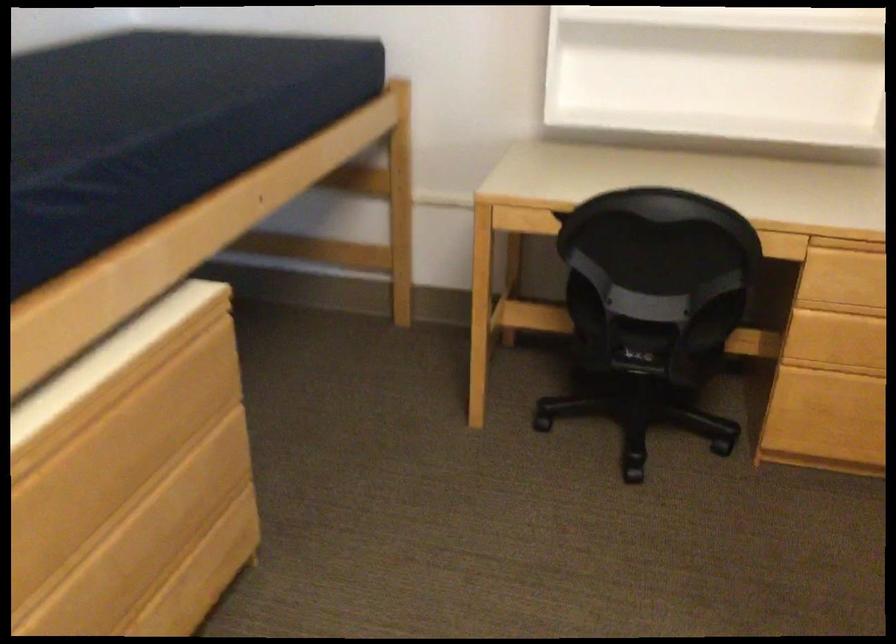
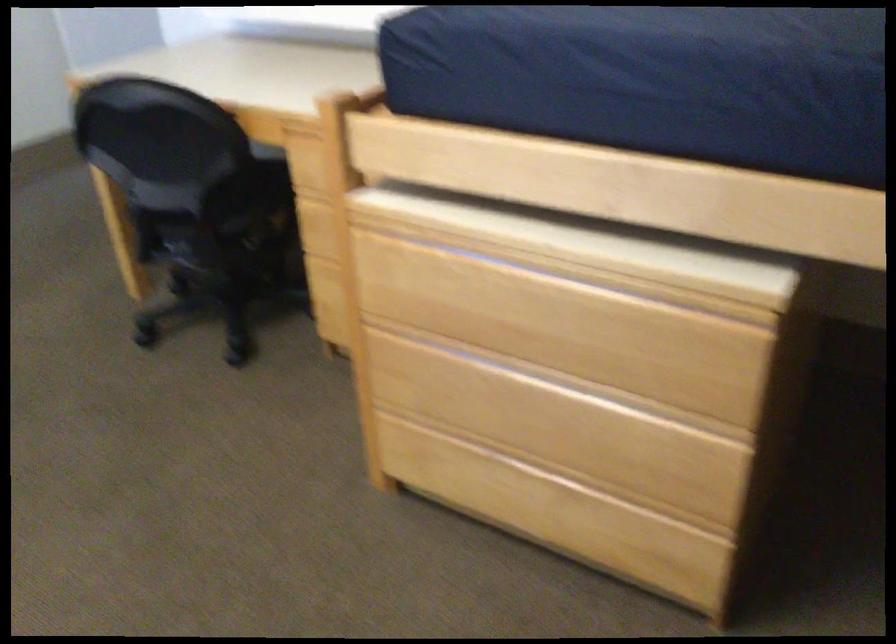
Where in the second image is the point corresponding to [108,460] from the first image?

(543, 315)